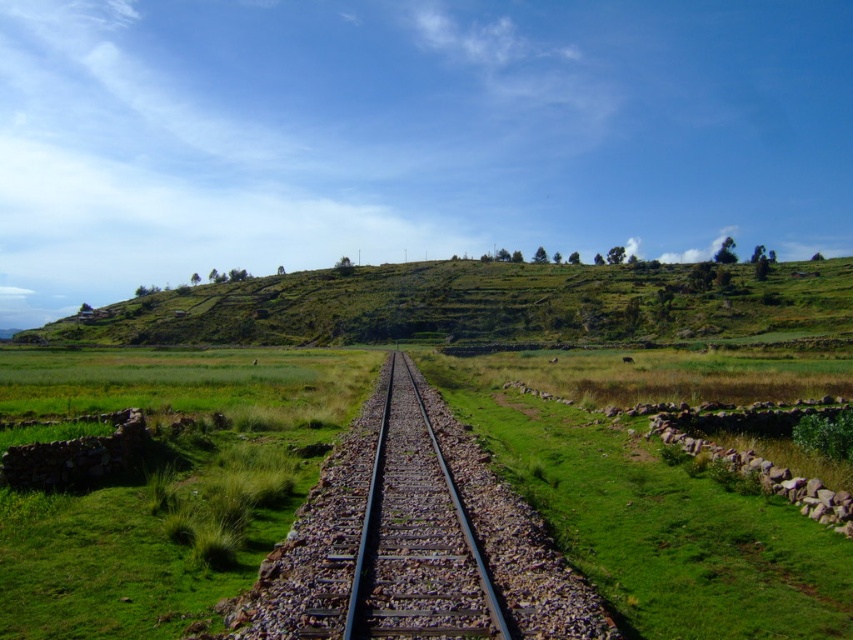
Question: Is green grassy hillside at center positioned at the back of metal/smooth train track at center?

Choices:
 (A) yes
 (B) no

Answer: (A)

Question: Which object is farther from the camera taking this photo?

Choices:
 (A) green grassy hillside at center
 (B) metal/smooth train track at center

Answer: (A)

Question: Can you confirm if green grassy hillside at center is bigger than metal/smooth train track at center?

Choices:
 (A) yes
 (B) no

Answer: (A)

Question: Which object is farther from the camera taking this photo?

Choices:
 (A) metal/smooth train track at center
 (B) green grassy hillside at center

Answer: (B)

Question: Among these objects, which one is nearest to the camera?

Choices:
 (A) green grassy hillside at center
 (B) metal/smooth train track at center

Answer: (B)

Question: Is green grassy hillside at center wider than metal/smooth train track at center?

Choices:
 (A) no
 (B) yes

Answer: (B)